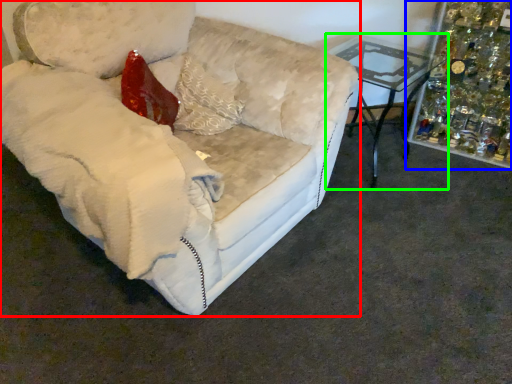
Question: Estimate the real-world distances between objects in this image. Which object is farther from studio couch (highlighted by a red box), christmas decoration (highlighted by a blue box) or table (highlighted by a green box)?

Choices:
 (A) christmas decoration
 (B) table

Answer: (A)